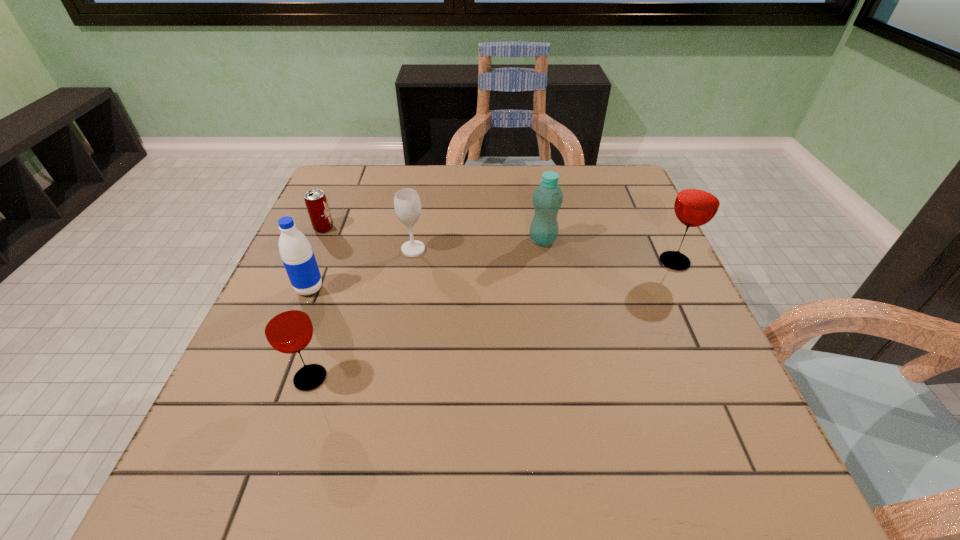
At what (x,y) coordinates should I click in order to perform the action: click on glass positioned at the left edge. Please return your answer as a coordinate pair (x, y). The height and width of the screenshot is (540, 960). Looking at the image, I should click on (287, 326).

Locate an element on the screen. This screenshot has width=960, height=540. water bottle that is at the left edge is located at coordinates (298, 258).

Where is `beer can present at the left edge`? The height and width of the screenshot is (540, 960). beer can present at the left edge is located at coordinates (316, 203).

The height and width of the screenshot is (540, 960). Identify the location of object located in the right edge section of the desktop. (697, 202).

Identify the location of object at the near left corner. (287, 326).

Where is `vacant area at the far edge of the desktop`? vacant area at the far edge of the desktop is located at coordinates click(x=525, y=176).

The height and width of the screenshot is (540, 960). I want to click on free space at the near edge of the desktop, so (442, 418).

You are a GUI agent. You are given a task and a screenshot of the screen. Output one action in this format:
    pyautogui.click(x=<x>, y=<y>)
    Task: Click on the vacant space at the left edge of the desktop
    
    Given the screenshot: What is the action you would take?
    pyautogui.click(x=322, y=266)

Find the location of a particular element. Image resolution: width=960 pixels, height=540 pixels. free region at the right edge of the desktop is located at coordinates [x=712, y=354].

Where is `vacant space at the far left corner of the desktop`? The height and width of the screenshot is (540, 960). vacant space at the far left corner of the desktop is located at coordinates click(x=366, y=172).